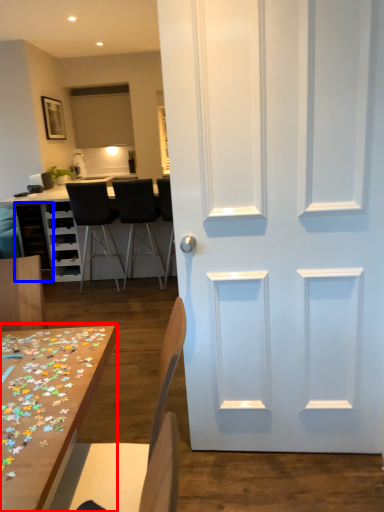
Question: Which of the following is the closest to the observer, table (highlighted by a red box) or cabinetry (highlighted by a blue box)?

Choices:
 (A) table
 (B) cabinetry

Answer: (A)